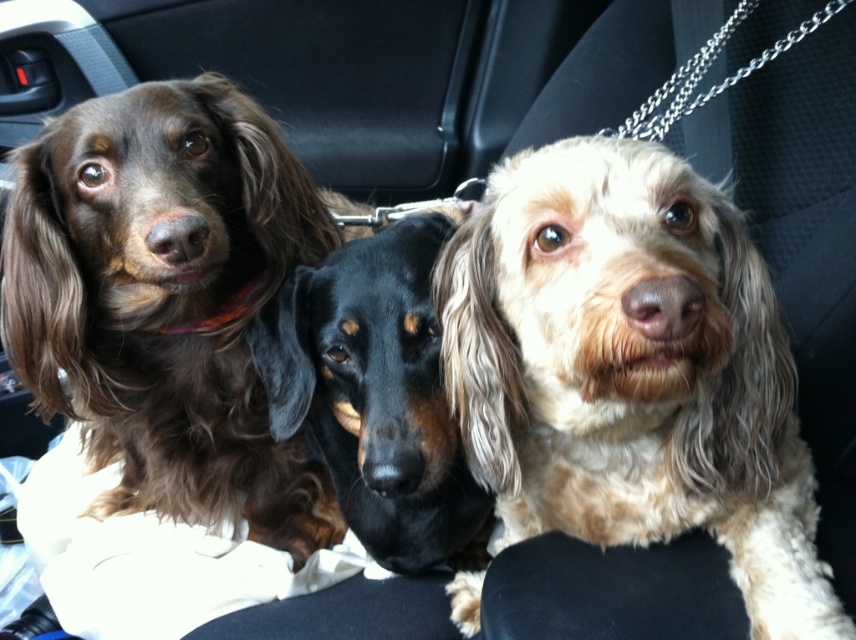
Question: Is light brown fur at center to the left of black shiny coat at center from the viewer's perspective?

Choices:
 (A) yes
 (B) no

Answer: (B)

Question: Is brown fur dog at left positioned in front of black shiny coat at center?

Choices:
 (A) no
 (B) yes

Answer: (A)

Question: Which is nearer to the black shiny coat at center?

Choices:
 (A) brown fur dog at left
 (B) light brown fur at center

Answer: (B)

Question: Which of these objects is positioned closest to the brown fur dog at left?

Choices:
 (A) black shiny coat at center
 (B) light brown fur at center

Answer: (A)

Question: Which is nearer to the brown fur dog at left?

Choices:
 (A) light brown fur at center
 (B) black shiny coat at center

Answer: (B)

Question: Can you confirm if brown fur dog at left is positioned to the left of black shiny coat at center?

Choices:
 (A) no
 (B) yes

Answer: (B)